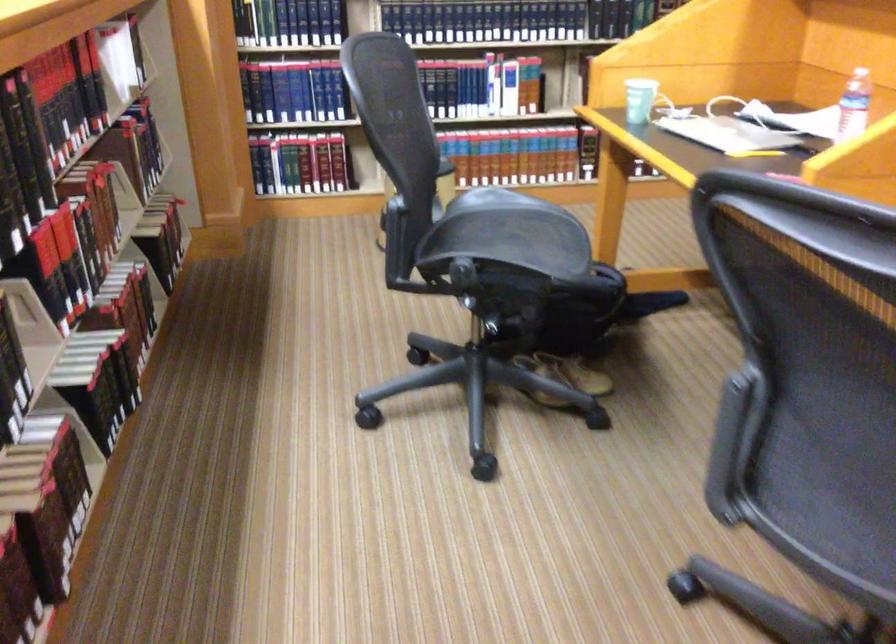
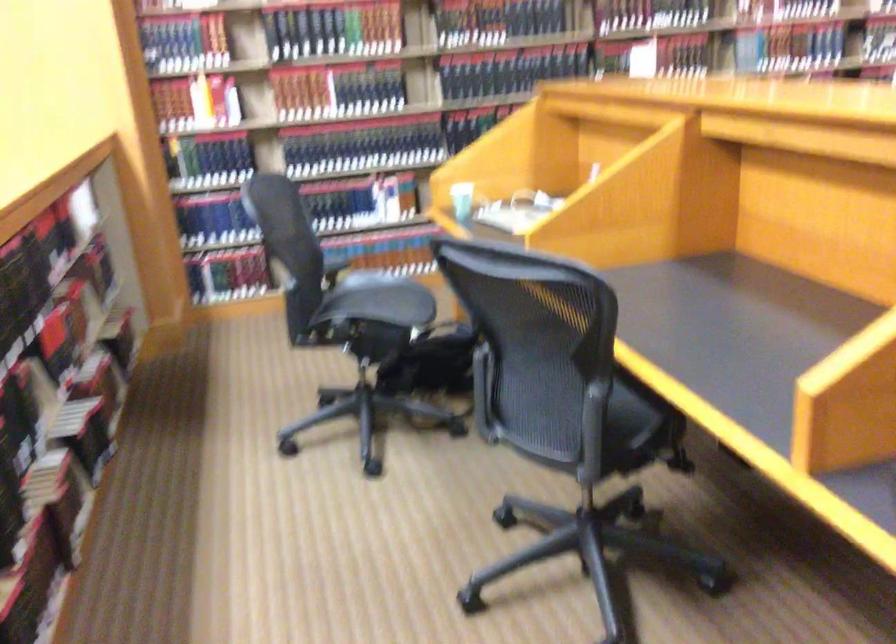
Question: The images are taken continuously from a first-person perspective. In which direction are you moving?

Choices:
 (A) Left
 (B) Right
 (C) Forward
 (D) Backward

Answer: (D)